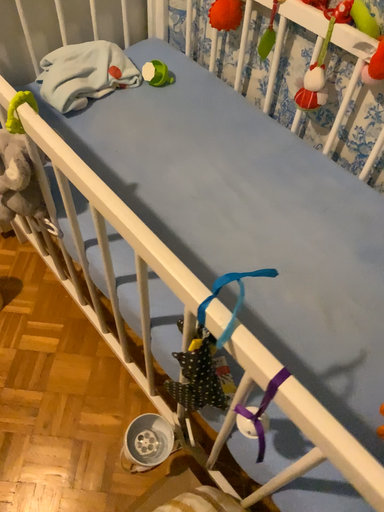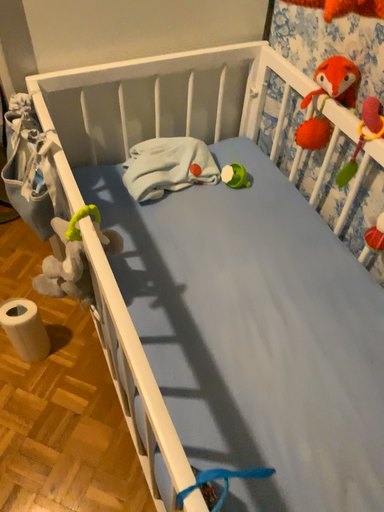
Question: How did the camera likely rotate when shooting the video?

Choices:
 (A) rotated downward
 (B) rotated upward

Answer: (B)